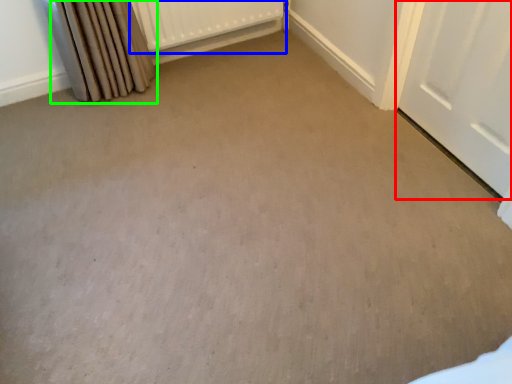
Question: Estimate the real-world distances between objects in this image. Which object is closer to door (highlighted by a red box), radiator (highlighted by a blue box) or curtain (highlighted by a green box)?

Choices:
 (A) radiator
 (B) curtain

Answer: (A)